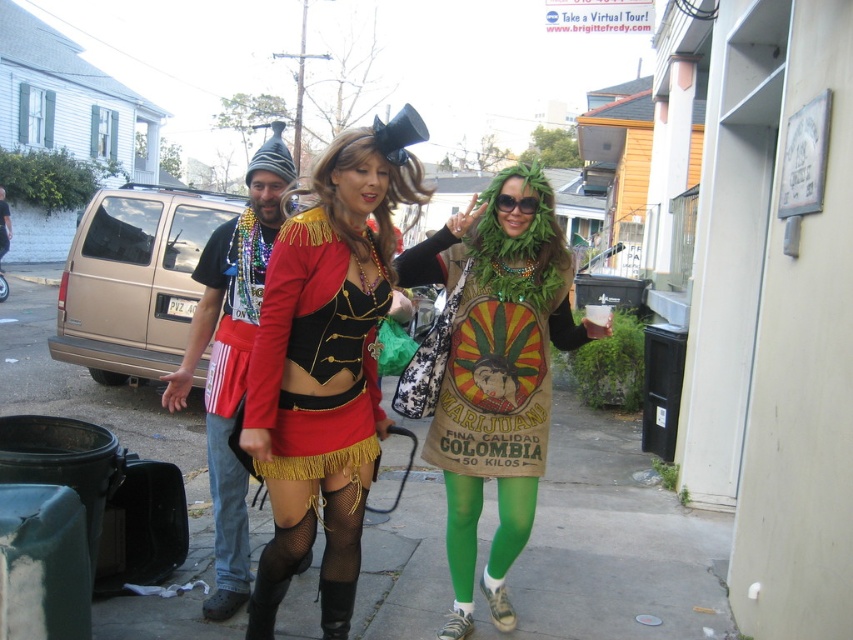
Can you confirm if shiny gold fringed jacket at center is positioned to the left of jeans at lower left?

In fact, shiny gold fringed jacket at center is to the right of jeans at lower left.

Locate an element on the screen. shiny gold fringed jacket at center is located at coordinates (314, 355).

Identify the location of shiny gold fringed jacket at center. This screenshot has width=853, height=640. (314, 355).

Is concrete sidewalk at center wider than matte black t-shirt at center?

Correct, the width of concrete sidewalk at center exceeds that of matte black t-shirt at center.

Between point (668, 532) and point (260, 193), which one is positioned in front?

Point (260, 193) is in front.

Between point (280, 630) and point (199, 330), which one is positioned in front?

Point (280, 630) is more forward.

Identify the location of concrete sidewalk at center. (613, 545).

Is shiny red fabric dress at center smaller than shiny gold fringed jacket at center?

Actually, shiny red fabric dress at center might be larger than shiny gold fringed jacket at center.

This screenshot has width=853, height=640. Find the location of `shiny red fabric dress at center`. shiny red fabric dress at center is located at coordinates (325, 365).